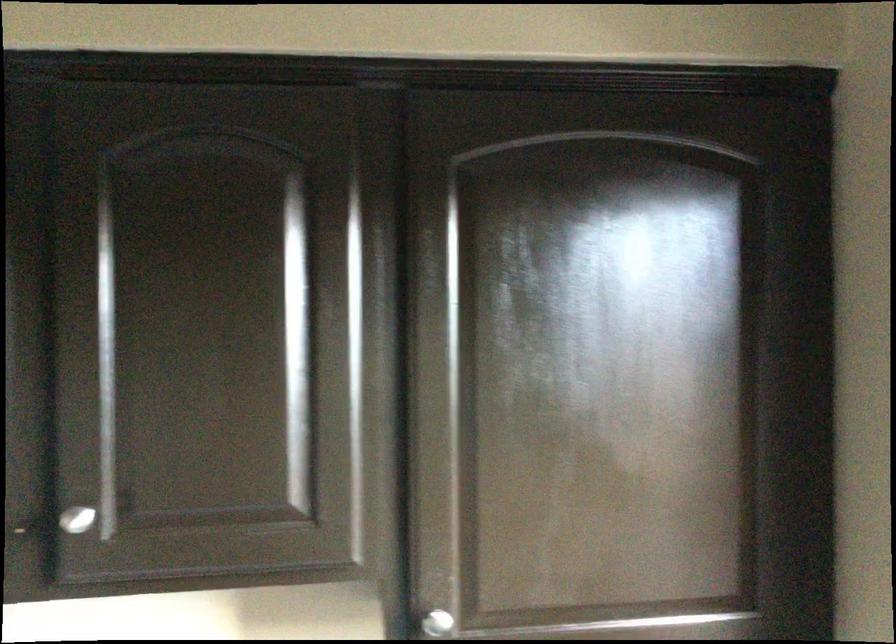
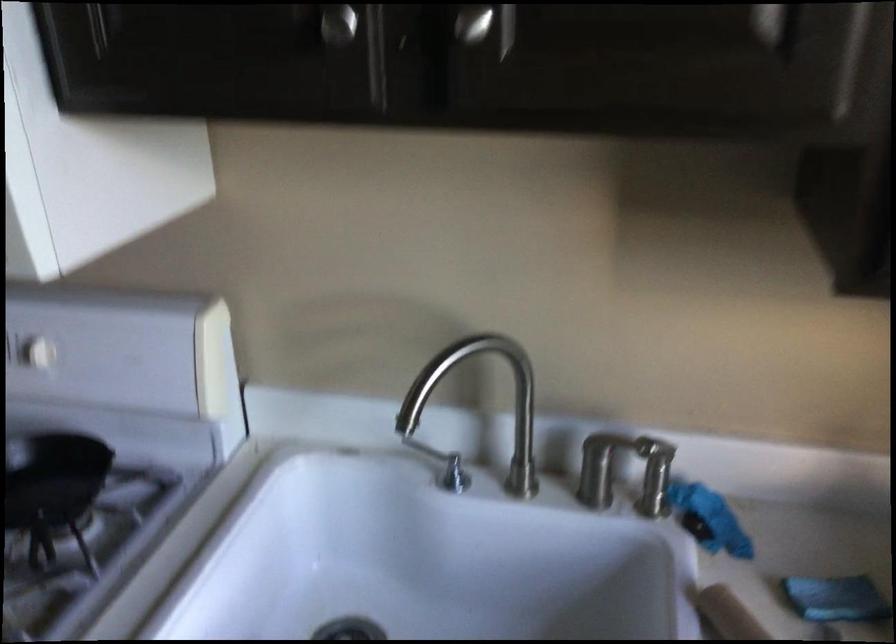
The point at (72,520) is marked in the first image. Where is the corresponding point in the second image?

(472, 23)